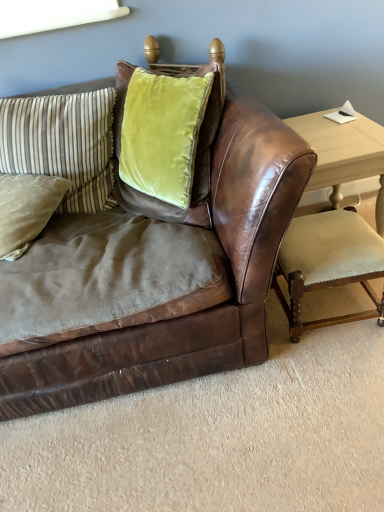
Where is `free location in front of velvet beige armchair at lower right`? The width and height of the screenshot is (384, 512). free location in front of velvet beige armchair at lower right is located at coordinates (330, 372).